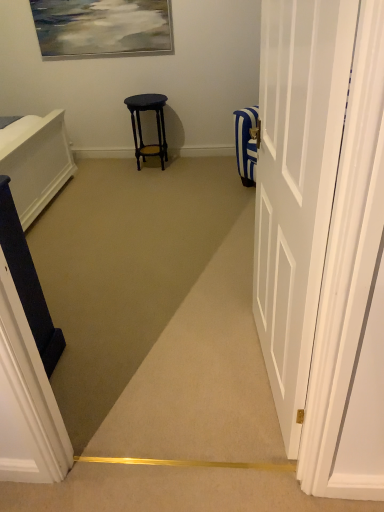
Question: Is matte black stool at center taller or shorter than dark blue fabric at left?

Choices:
 (A) tall
 (B) short

Answer: (B)

Question: From a real-world perspective, relative to dark blue fabric at left, is matte black stool at center vertically above or below?

Choices:
 (A) below
 (B) above

Answer: (A)

Question: Considering the real-world distances, which object is farthest from the white glossy door at right?

Choices:
 (A) matte black stool at center
 (B) dark blue fabric at left

Answer: (A)

Question: Considering the real-world distances, which object is closest to the white glossy door at right?

Choices:
 (A) dark blue fabric at left
 (B) matte black stool at center

Answer: (A)